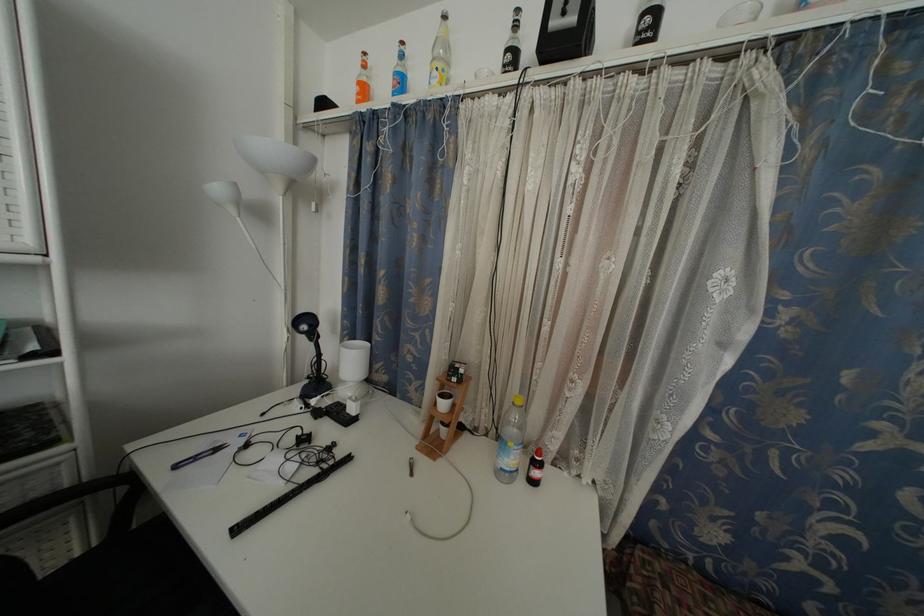
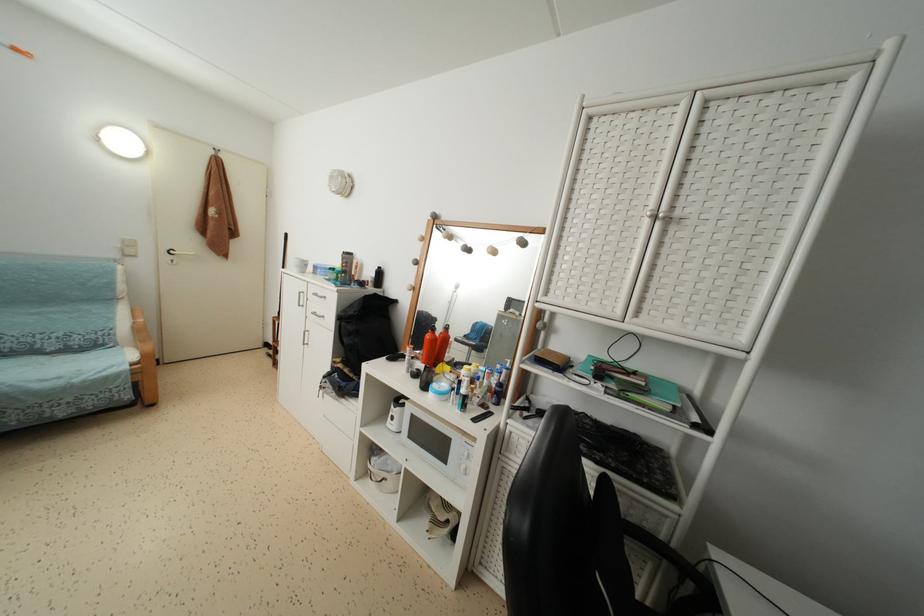
Question: Based on the continuous images, in which direction is the camera rotating? Reply with the corresponding letter.

Choices:
 (A) Left
 (B) Right
 (C) Up
 (D) Down

Answer: (A)